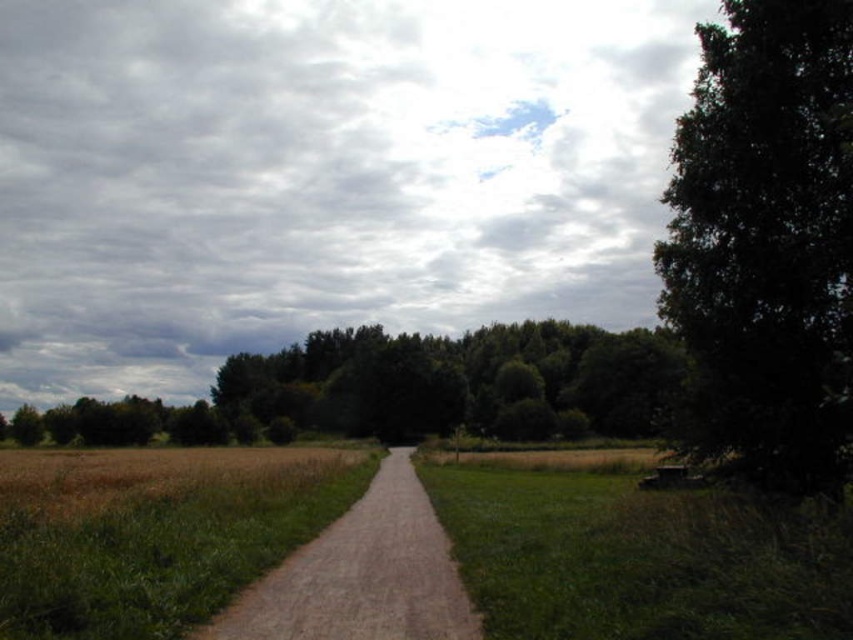
You are standing at the starting point of the paved path in the rural scene. You want to walk towards the dark green leafy tree at right. Which direction should you head?

The dark green leafy tree at right is located at the right side of the path, so you should head towards the right direction to reach it.